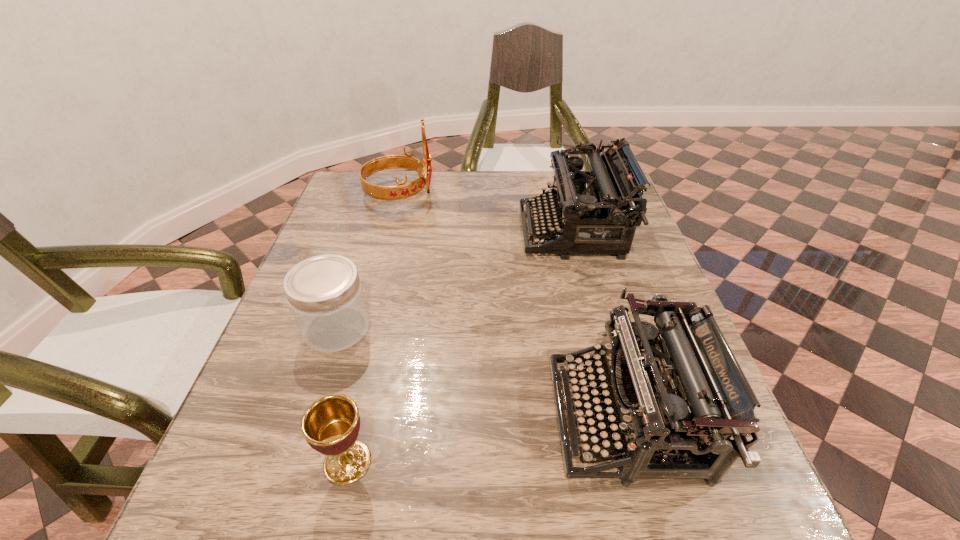
At what (x,y) coordinates should I click in order to perform the action: click on jar that is at the left edge. Please return your answer as a coordinate pair (x, y). The width and height of the screenshot is (960, 540). Looking at the image, I should click on (324, 292).

The width and height of the screenshot is (960, 540). I want to click on object located at the far left corner, so click(x=404, y=190).

You are a GUI agent. You are given a task and a screenshot of the screen. Output one action in this format:
    pyautogui.click(x=<x>, y=<y>)
    Task: Click on the object that is at the far right corner
    This screenshot has width=960, height=540.
    Given the screenshot: What is the action you would take?
    pyautogui.click(x=592, y=210)

The width and height of the screenshot is (960, 540). What are the coordinates of `object located in the near right corner section of the desktop` in the screenshot? It's located at (685, 395).

This screenshot has height=540, width=960. In the image, there is a desktop. Identify the location of vacant area at the far edge. (484, 204).

The image size is (960, 540). In the image, there is a desktop. Find the location of `vacant space at the near edge`. vacant space at the near edge is located at coordinates (562, 529).

Identify the location of free space at the left edge of the desktop. The width and height of the screenshot is (960, 540). (315, 385).

Where is `free location at the right edge of the desktop`? This screenshot has width=960, height=540. free location at the right edge of the desktop is located at coordinates (644, 255).

In the image, there is a desktop. Where is `free space at the far left corner`? This screenshot has height=540, width=960. free space at the far left corner is located at coordinates [394, 181].

Find the location of a particular element. The width and height of the screenshot is (960, 540). blank space at the near right corner of the desktop is located at coordinates (720, 529).